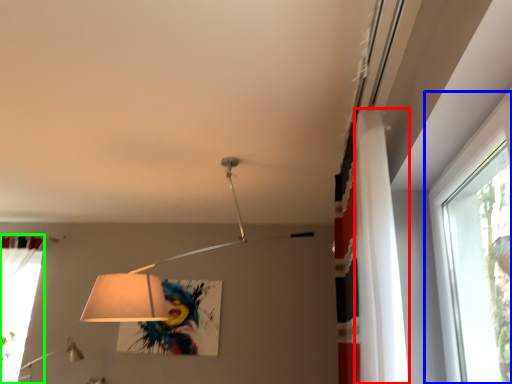
Question: Which object is the closest to the curtain (highlighted by a red box)? Choose among these: window (highlighted by a blue box) or curtain (highlighted by a green box).

Choices:
 (A) window
 (B) curtain

Answer: (A)